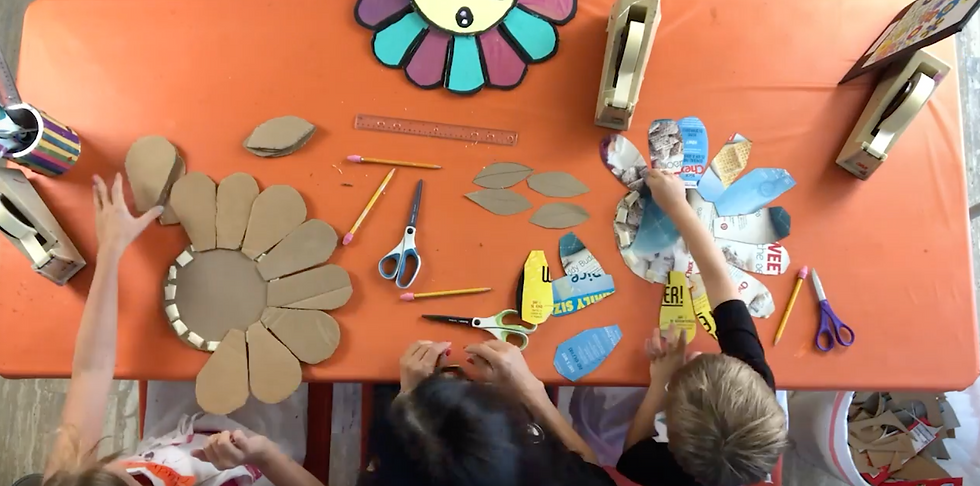
At what (x,y) coordinates should I click in order to perform the action: click on table, covered in orange paper. Please return your answer as a coordinate pair (x, y). Looking at the image, I should click on (218, 66).